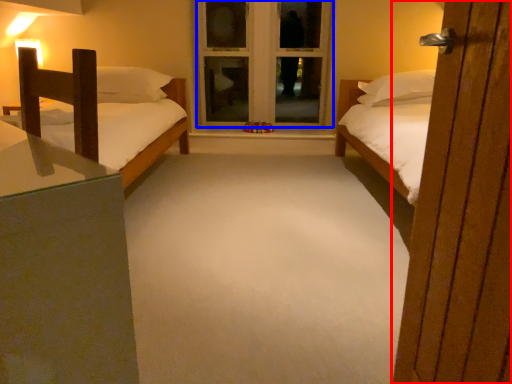
Question: Among these objects, which one is farthest to the camera, door (highlighted by a red box) or window frame (highlighted by a blue box)?

Choices:
 (A) door
 (B) window frame

Answer: (B)